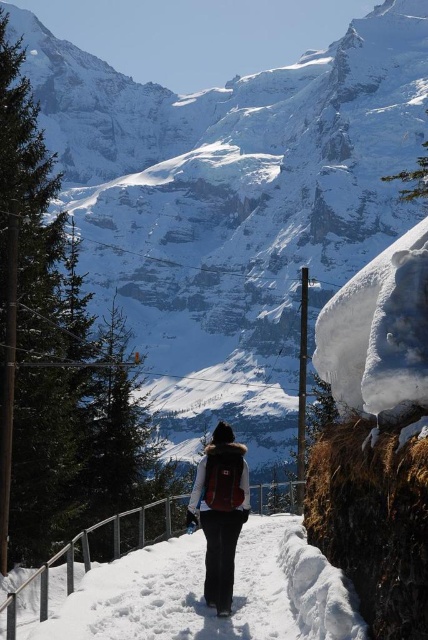
Question: Among these points, which one is nearest to the camera?

Choices:
 (A) (83, 634)
 (B) (228, 515)

Answer: (A)

Question: Which point appears farthest from the camera in this image?

Choices:
 (A) (240, 476)
 (B) (172, 556)

Answer: (B)

Question: Is black fabric pants at center bigger than matte brown backpack at center?

Choices:
 (A) yes
 (B) no

Answer: (A)

Question: Does black fabric pants at center lie in front of matte brown backpack at center?

Choices:
 (A) yes
 (B) no

Answer: (A)

Question: Which point is farther to the camera?

Choices:
 (A) black fabric pants at center
 (B) matte brown backpack at center

Answer: (B)

Question: Does black fabric pants at center come behind matte brown backpack at center?

Choices:
 (A) no
 (B) yes

Answer: (A)